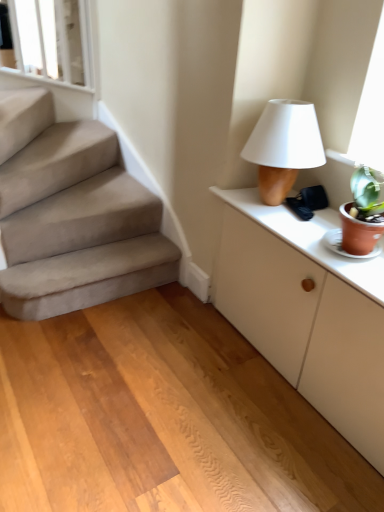
Where is `free space above wooden floor at center (from a real-world perspective)`? This screenshot has height=512, width=384. free space above wooden floor at center (from a real-world perspective) is located at coordinates (148, 389).